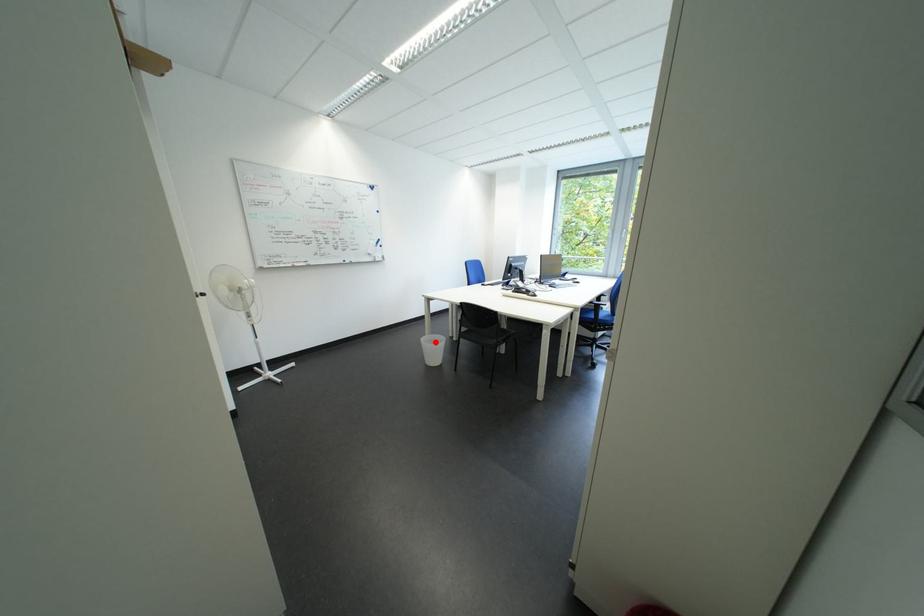
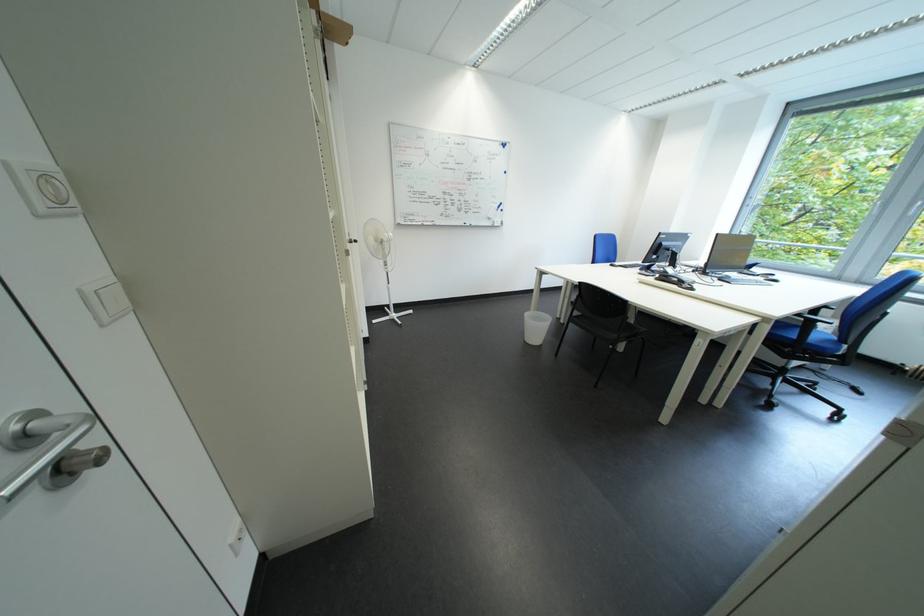
Find the pixel in the second image that matches the highlighted location in the first image.

(540, 317)